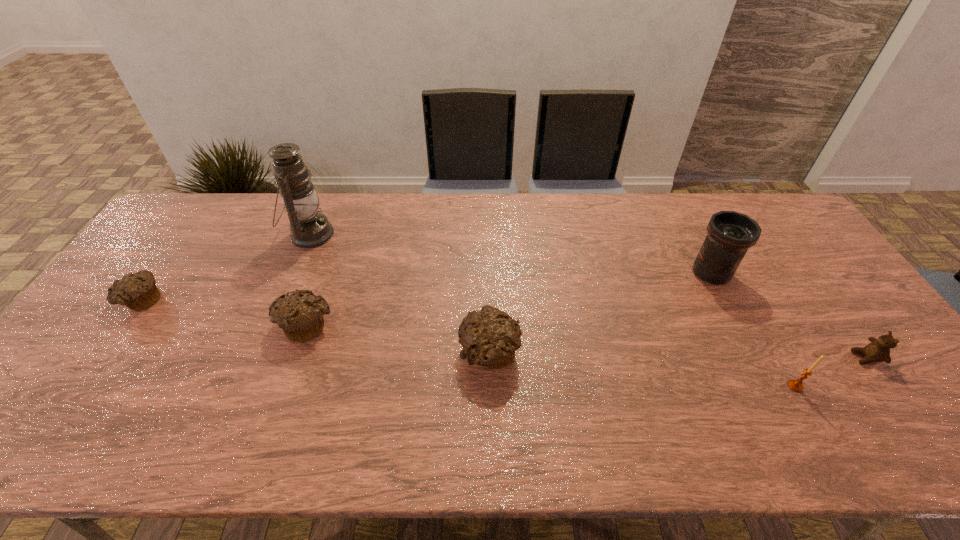
The image size is (960, 540). Identify the location of free space between the teddy bear and the telephoto lens. (788, 315).

Identify the location of free space between the farthest object and the leftmost muffin. (227, 267).

Where is `vacant space that's between the rightmost object and the candle_holder`? Image resolution: width=960 pixels, height=540 pixels. vacant space that's between the rightmost object and the candle_holder is located at coordinates coord(830,372).

Where is `vacant space in between the candle_holder and the sixth shortest object`? The height and width of the screenshot is (540, 960). vacant space in between the candle_holder and the sixth shortest object is located at coordinates (753, 329).

I want to click on unoccupied position between the rightmost object and the second shortest muffin, so click(x=587, y=341).

Identify the location of free area in between the shortest muffin and the farthest object. (227, 267).

Identify the location of free space between the farthest object and the shortest muffin. Image resolution: width=960 pixels, height=540 pixels. (227, 267).

You are a GUI agent. You are given a task and a screenshot of the screen. Output one action in this format:
    pyautogui.click(x=<x>, y=<y>)
    Task: Click on the vacant region between the shortest muffin and the tallest object
    
    Given the screenshot: What is the action you would take?
    pyautogui.click(x=227, y=267)

Locate an element on the screen. vacant area between the second shortest muffin and the telephoto lens is located at coordinates (509, 299).

What are the coordinates of `object that can be found as the second closest to the fourth object from right to left` in the screenshot? It's located at (309, 228).